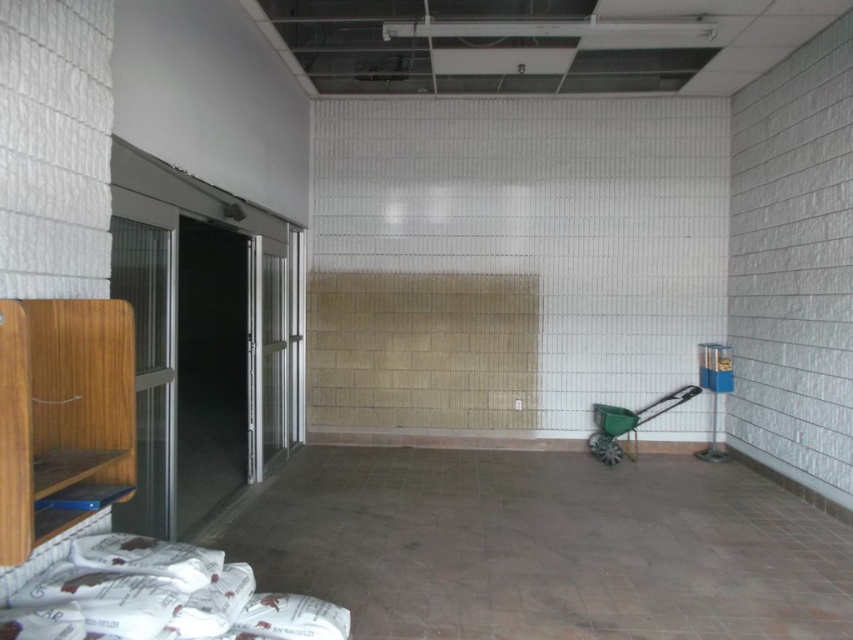
Consider the image. Which is more to the left, brown concrete floor at lower center or green plastic wheelbarrow at lower right?

brown concrete floor at lower center is more to the left.

Who is more forward, (746, 524) or (592, 410)?

Positioned in front is point (746, 524).

The image size is (853, 640). I want to click on brown concrete floor at lower center, so click(541, 547).